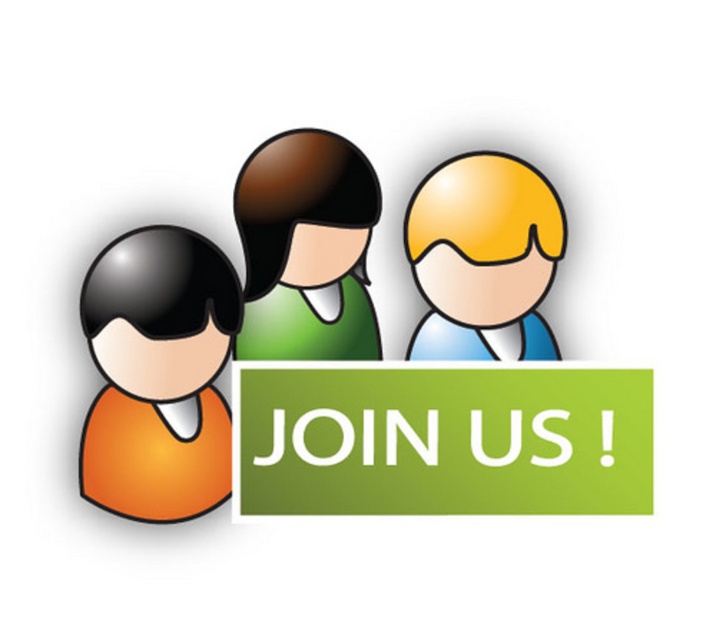
Question: Is green matte sign at center thinner than orange matte head at left?

Choices:
 (A) no
 (B) yes

Answer: (A)

Question: Among these points, which one is farthest from the camera?

Choices:
 (A) (480, 195)
 (B) (311, 486)
 (C) (216, 250)

Answer: (A)

Question: Does green matte sign at center have a larger size compared to orange matte head at left?

Choices:
 (A) yes
 (B) no

Answer: (A)

Question: Does green matte sign at center appear on the left side of orange matte head at left?

Choices:
 (A) yes
 (B) no

Answer: (B)

Question: Which object is positioned farthest from the orange matte head at left?

Choices:
 (A) matte green shirt at center
 (B) green matte shirt at center
 (C) matte yellow head at upper right

Answer: (C)

Question: Among these objects, which one is farthest from the camera?

Choices:
 (A) green matte sign at center
 (B) matte green shirt at center
 (C) matte yellow head at upper right
 (D) green matte shirt at center

Answer: (D)